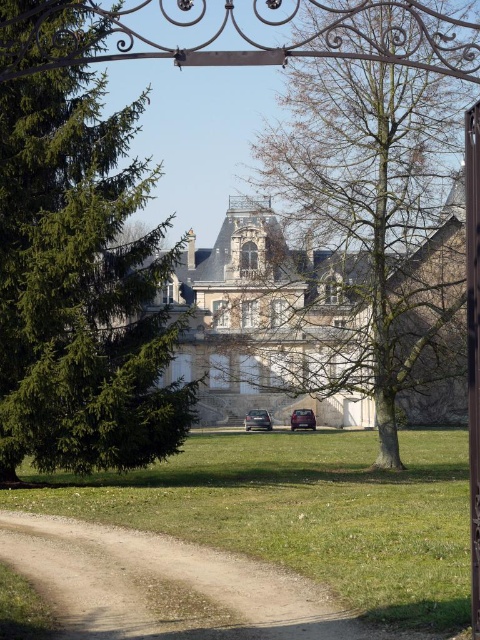
Question: Does metallic gate at center have a larger size compared to matte black car at center?

Choices:
 (A) no
 (B) yes

Answer: (B)

Question: Can you confirm if bare wood tree at center is bigger than dirt path at lower left?

Choices:
 (A) yes
 (B) no

Answer: (A)

Question: Does green matte tree at left appear over metallic gate at center?

Choices:
 (A) no
 (B) yes

Answer: (B)

Question: Which of these objects is positioned closest to the metallic gate at center?

Choices:
 (A) bare wood tree at center
 (B) matte black car at center
 (C) green matte tree at left

Answer: (C)

Question: Which point is farther to the camera?

Choices:
 (A) (477, 180)
 (B) (385, 61)

Answer: (B)

Question: Which point appears farthest from the camera in this image?

Choices:
 (A) (254, 419)
 (B) (475, 205)
 (C) (309, 424)
 (D) (99, 237)

Answer: (C)